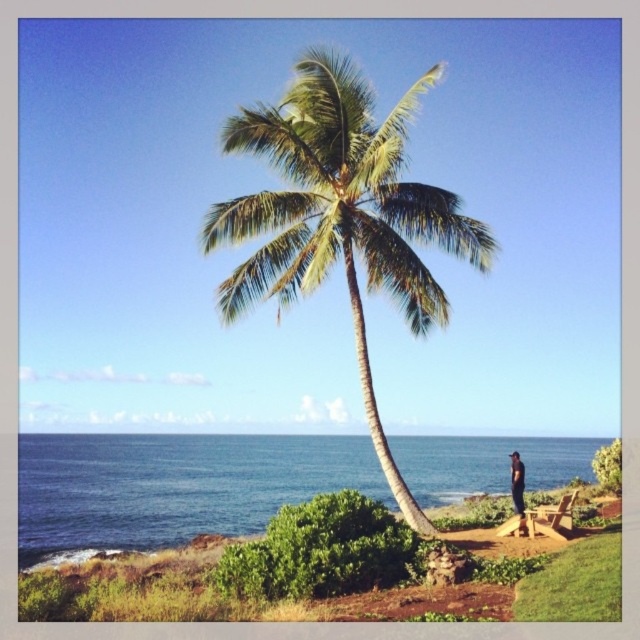
Can you confirm if blue water at lower left is bigger than dark blue jeans at lower right?

Indeed, blue water at lower left has a larger size compared to dark blue jeans at lower right.

Who is positioned more to the right, blue water at lower left or dark blue jeans at lower right?

dark blue jeans at lower right

Is point (36, 456) less distant than point (515, 499)?

That is False.

Identify the location of blue water at lower left. (172, 486).

Who is more distant from viewer, (236, 314) or (516, 512)?

The point (236, 314) is behind.

Does green leafy coconut tree at center appear on the right side of dark blue jeans at lower right?

→ No, green leafy coconut tree at center is not to the right of dark blue jeans at lower right.

Measure the distance between green leafy coconut tree at center and camera.

green leafy coconut tree at center is 12.15 meters away from camera.

The width and height of the screenshot is (640, 640). In order to click on green leafy coconut tree at center in this screenshot , I will do `click(340, 216)`.

The image size is (640, 640). Identify the location of green leafy coconut tree at center. (340, 216).

Is point (486, 262) closer to camera compared to point (436, 502)?

Yes, point (486, 262) is in front of point (436, 502).

Locate an element on the screen. The height and width of the screenshot is (640, 640). green leafy coconut tree at center is located at coordinates (340, 216).

Locate an element on the screen. This screenshot has height=640, width=640. green leafy coconut tree at center is located at coordinates (340, 216).